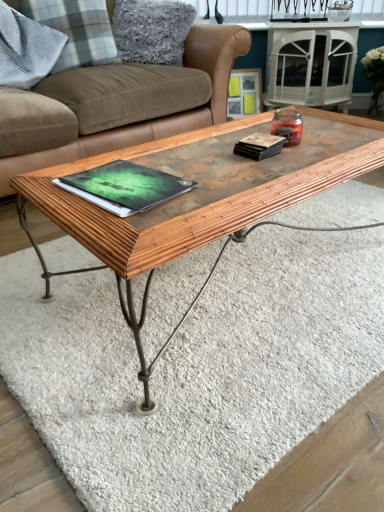
Question: Does matte black book at upper right, acting as the second book starting from the left, appear on the right side of green matte book at center, placed as the 2th book when sorted from right to left?

Choices:
 (A) yes
 (B) no

Answer: (A)

Question: From a real-world perspective, is matte black book at upper right, which is the 2th book in bottom-to-top order, positioned over green matte book at center, acting as the first book starting from the left, based on gravity?

Choices:
 (A) yes
 (B) no

Answer: (A)

Question: From the image's perspective, is matte black book at upper right, which is counted as the first book, starting from the right, on green matte book at center, acting as the first book starting from the left?

Choices:
 (A) yes
 (B) no

Answer: (A)

Question: Is matte black book at upper right, acting as the second book starting from the left, thinner than green matte book at center, acting as the first book starting from the left?

Choices:
 (A) no
 (B) yes

Answer: (B)

Question: From a real-world perspective, is matte black book at upper right, acting as the second book starting from the left, located beneath green matte book at center, which appears as the 2th book when viewed from the top?

Choices:
 (A) yes
 (B) no

Answer: (B)

Question: Is matte black book at upper right, which is the 2th book in bottom-to-top order, wider than green matte book at center, placed as the 2th book when sorted from right to left?

Choices:
 (A) yes
 (B) no

Answer: (B)

Question: From a real-world perspective, does green matte book at center, placed as the 2th book when sorted from right to left, stand above wooden picture frame at upper center?

Choices:
 (A) yes
 (B) no

Answer: (A)

Question: Is there a large distance between green matte book at center, which appears as the 2th book when viewed from the top, and wooden picture frame at upper center?

Choices:
 (A) yes
 (B) no

Answer: (A)

Question: Considering the relative sizes of green matte book at center, arranged as the first book when ordered from the bottom, and wooden picture frame at upper center in the image provided, is green matte book at center, arranged as the first book when ordered from the bottom, taller than wooden picture frame at upper center?

Choices:
 (A) yes
 (B) no

Answer: (B)

Question: Is the depth of green matte book at center, placed as the 2th book when sorted from right to left, greater than that of wooden picture frame at upper center?

Choices:
 (A) yes
 (B) no

Answer: (B)

Question: Is green matte book at center, placed as the 2th book when sorted from right to left, shorter than wooden picture frame at upper center?

Choices:
 (A) no
 (B) yes

Answer: (B)

Question: Is green matte book at center, placed as the 2th book when sorted from right to left, bigger than wooden picture frame at upper center?

Choices:
 (A) no
 (B) yes

Answer: (A)

Question: Considering the relative sizes of matte black book at upper right, which is counted as the first book, starting from the right, and wooden textured coffee table at center in the image provided, is matte black book at upper right, which is counted as the first book, starting from the right, taller than wooden textured coffee table at center?

Choices:
 (A) yes
 (B) no

Answer: (B)